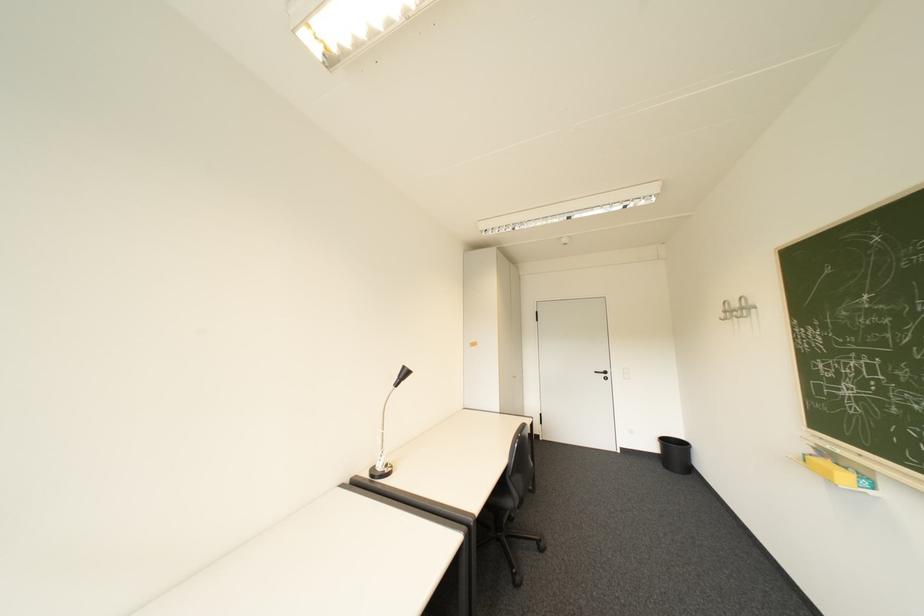
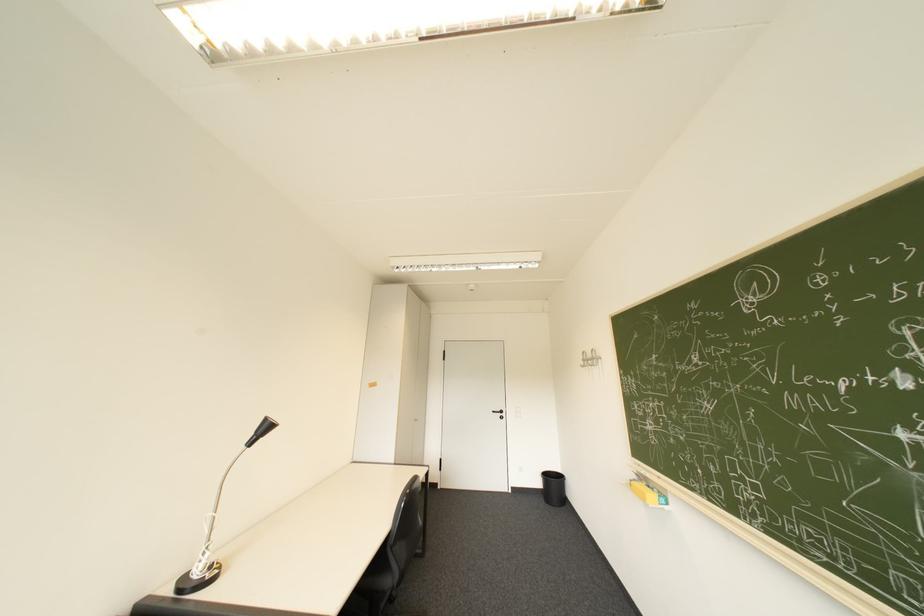
Locate, in the second image, the point that corresponds to point (733, 315) in the first image.

(591, 363)